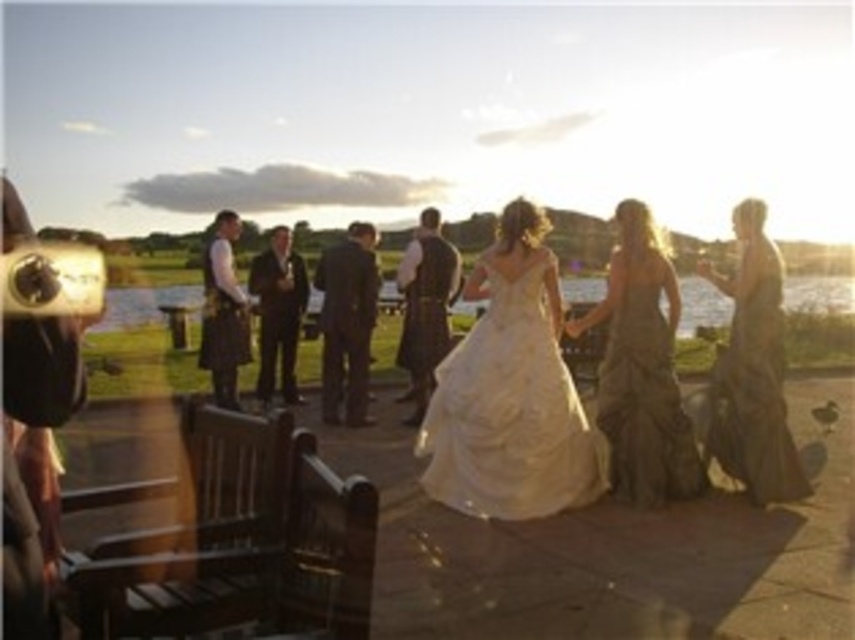
Is dark gray kilt at center taller than dark suit at center?

Yes, dark gray kilt at center is taller than dark suit at center.

Locate an element on the screen. This screenshot has width=855, height=640. dark gray kilt at center is located at coordinates (223, 312).

You are a GUI agent. You are given a task and a screenshot of the screen. Output one action in this format:
    pyautogui.click(x=<x>, y=<y>)
    Task: Click on the dark gray kilt at center
    The image size is (855, 640).
    Given the screenshot: What is the action you would take?
    pyautogui.click(x=223, y=312)

Locate an element on the screen. dark gray kilt at center is located at coordinates (223, 312).

Who is lower down, ivory satin gown at center or shiny silver dress at center?

ivory satin gown at center is lower down.

Is ivory satin gown at center to the right of shiny silver dress at center from the viewer's perspective?

Incorrect, ivory satin gown at center is not on the right side of shiny silver dress at center.

What do you see at coordinates (509, 416) in the screenshot?
I see `ivory satin gown at center` at bounding box center [509, 416].

Identify the location of ivory satin gown at center. The height and width of the screenshot is (640, 855). (509, 416).

Which is in front, point (332, 384) or point (444, 276)?

Positioned in front is point (332, 384).

Between dark gray suit at center and velvet brown vest at center, which one has more height?

velvet brown vest at center

Find the location of a particular element. dark gray suit at center is located at coordinates (346, 321).

In order to click on dark gray suit at center in this screenshot , I will do `click(346, 321)`.